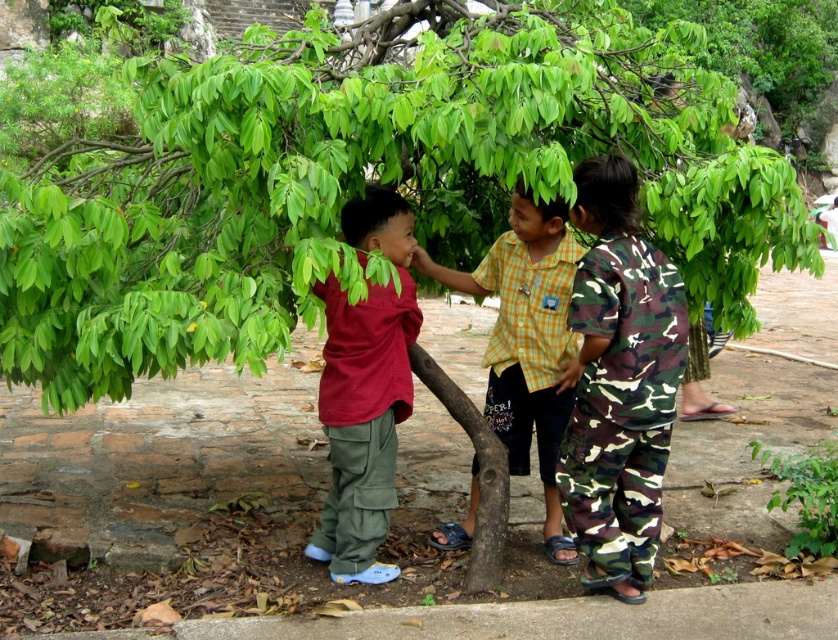
Question: Can you confirm if green leafy tree at center is wider than matte red shirt at center?

Choices:
 (A) yes
 (B) no

Answer: (A)

Question: Is green leafy tree at center thinner than yellow checkered shirt at center?

Choices:
 (A) no
 (B) yes

Answer: (A)

Question: Among these objects, which one is farthest from the camera?

Choices:
 (A) camouflage pants at right
 (B) yellow checkered shirt at center
 (C) matte red shirt at center

Answer: (B)

Question: Which of these objects is positioned closest to the matte red shirt at center?

Choices:
 (A) green leafy tree at center
 (B) camouflage pants at right
 (C) yellow checkered shirt at center

Answer: (C)

Question: Which of these objects is positioned closest to the matte red shirt at center?

Choices:
 (A) green leafy tree at center
 (B) camouflage pants at right
 (C) yellow checkered shirt at center

Answer: (C)

Question: Can you confirm if green leafy tree at center is positioned to the right of yellow checkered shirt at center?

Choices:
 (A) yes
 (B) no

Answer: (B)